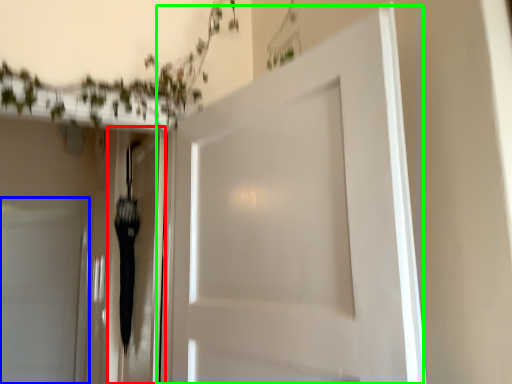
Question: Based on their relative distances, which object is farther from elevator (highlighted by a red box)? Choose from door (highlighted by a blue box) and door (highlighted by a green box).

Choices:
 (A) door
 (B) door

Answer: (A)